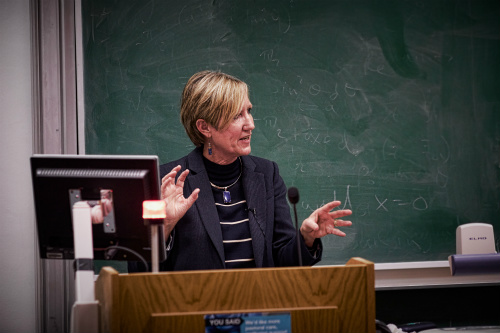
Locate an element on the screen. The width and height of the screenshot is (500, 333). back of lap top is located at coordinates (42, 213), (130, 195).